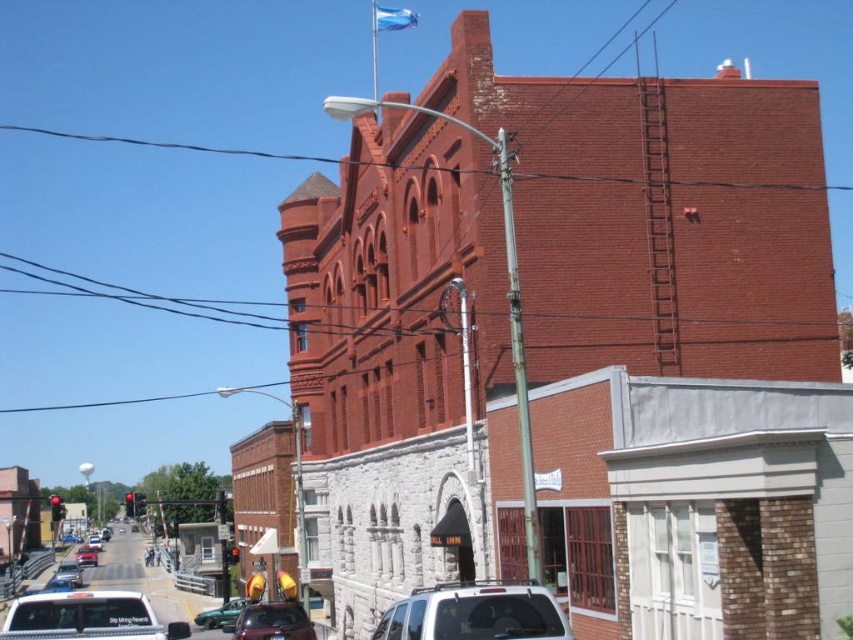
Does point (351, 353) come farther from viewer compared to point (248, 604)?

No.

Can you confirm if red brick building at center is positioned above metallic silver car at lower center?

Yes.

The height and width of the screenshot is (640, 853). What are the coordinates of `red brick building at center` in the screenshot? It's located at (531, 288).

Is red brick building at center further to the viewer compared to white matte suv at lower center?

Yes, it is behind white matte suv at lower center.

Is red brick building at center closer to camera compared to white matte suv at lower center?

No, red brick building at center is behind white matte suv at lower center.

Measure the distance between red brick building at center and camera.

72.68 feet

Image resolution: width=853 pixels, height=640 pixels. I want to click on red brick building at center, so click(x=531, y=288).

Does white matte suv at lower center have a greater height compared to shiny red sedan at lower left?

Incorrect, white matte suv at lower center's height is not larger of shiny red sedan at lower left's.

Is white matte suv at lower center shorter than shiny red sedan at lower left?

→ Indeed, white matte suv at lower center has a lesser height compared to shiny red sedan at lower left.

Is point (491, 627) less distant than point (70, 572)?

Yes, it is in front of point (70, 572).

This screenshot has height=640, width=853. Identify the location of white matte suv at lower center. (474, 612).